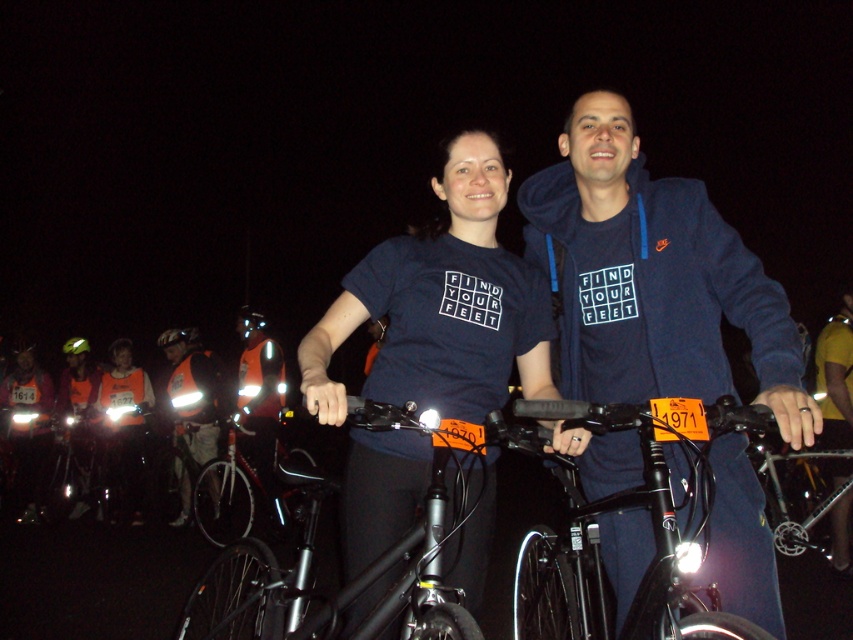
You are a photographer at a cycling event. You need to capture a photo of the navy blue hoodie at center and the shiny black helmet at center. Which object should you focus on first if you want to include both in the frame without moving the camera?

The navy blue hoodie at center is much taller than the shiny black helmet at center, so you should focus on the navy blue hoodie at center first to ensure it fits in the frame.

You are a photographer taking a picture of the black matte helmet at center and the green matte helmet at upper left. Which helmet is covering part of the other?

The black matte helmet at center is positioned over the green matte helmet at upper left, so it is covering part of it.